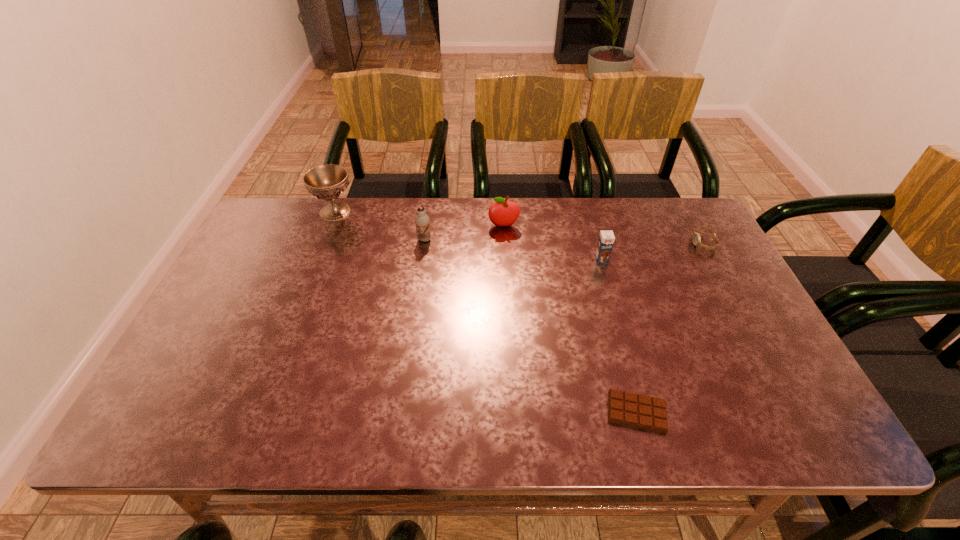
Where is `apple that is at the far edge`? apple that is at the far edge is located at coordinates (501, 213).

I want to click on watch positioned at the far edge, so click(696, 236).

I want to click on object located at the near edge, so click(x=634, y=410).

Locate an element on the screen. The width and height of the screenshot is (960, 540). object that is positioned at the left edge is located at coordinates (327, 182).

Find the location of a particular element. The width and height of the screenshot is (960, 540). object at the right edge is located at coordinates [696, 236].

Identify the location of object that is at the far left corner. pos(327,182).

Find the location of a particular element. object that is at the far right corner is located at coordinates (696, 236).

Locate an element on the screen. The image size is (960, 540). vacant area at the far edge is located at coordinates (634, 216).

This screenshot has height=540, width=960. In order to click on free space at the near edge of the desktop in this screenshot , I will do (x=361, y=440).

The width and height of the screenshot is (960, 540). What are the coordinates of `free space at the right edge of the desktop` in the screenshot? It's located at (682, 274).